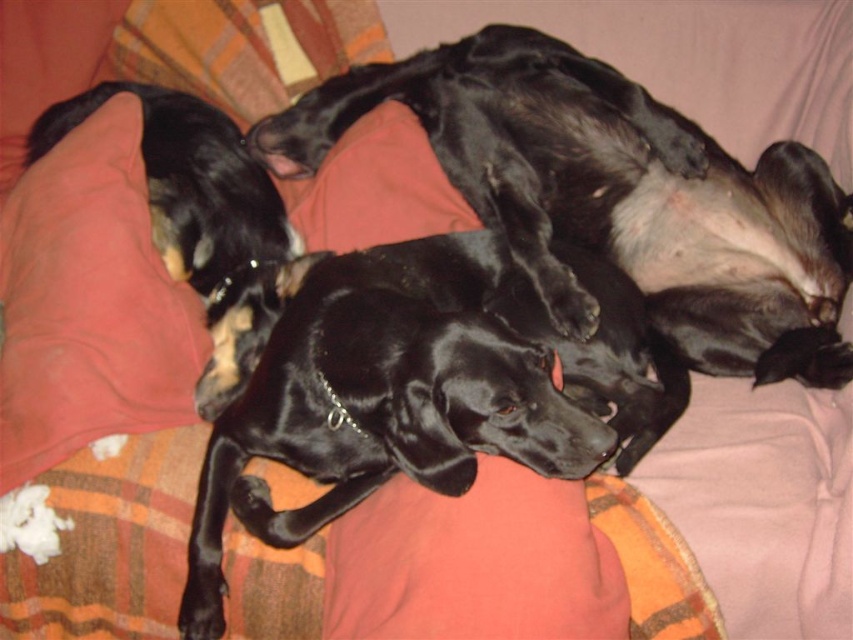
Question: Which of the following is the closest to the observer?

Choices:
 (A) cotton pillow at left
 (B) black shiny dog at center

Answer: (A)

Question: Is black shiny dog at center behind cotton pillow at left?

Choices:
 (A) no
 (B) yes

Answer: (B)

Question: Does black shiny dog at center have a greater width compared to cotton pillow at left?

Choices:
 (A) no
 (B) yes

Answer: (B)

Question: Is black shiny dog at center positioned behind cotton pillow at left?

Choices:
 (A) yes
 (B) no

Answer: (A)

Question: Which of the following is the closest to the observer?

Choices:
 (A) (9, 388)
 (B) (549, 218)

Answer: (A)